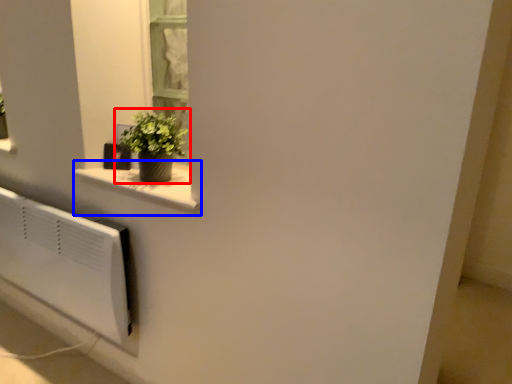
Question: Which object is further to the camera taking this photo, houseplant (highlighted by a red box) or window sill (highlighted by a blue box)?

Choices:
 (A) houseplant
 (B) window sill

Answer: (A)